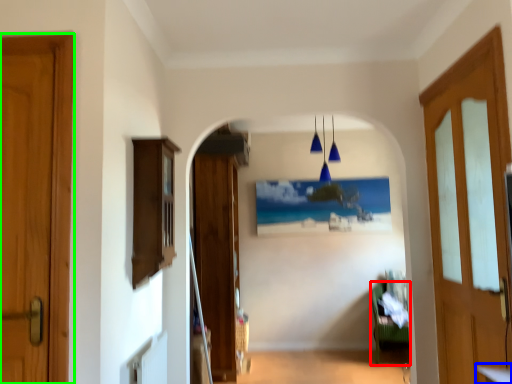
Question: Which object is the closest to the furniture (highlighted by a red box)? Choose among these: table (highlighted by a blue box) or door (highlighted by a green box).

Choices:
 (A) table
 (B) door

Answer: (A)